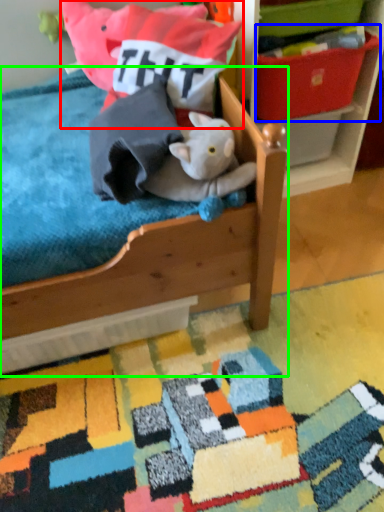
Question: Which object is the farthest from pillow (highlighted by a red box)? Choose among these: storage box (highlighted by a blue box) or furniture (highlighted by a green box).

Choices:
 (A) storage box
 (B) furniture

Answer: (B)